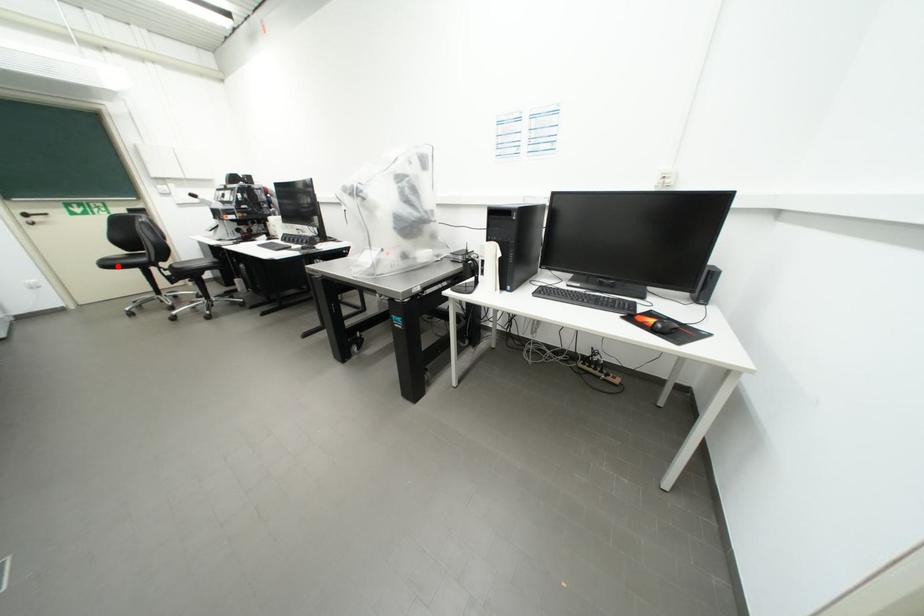
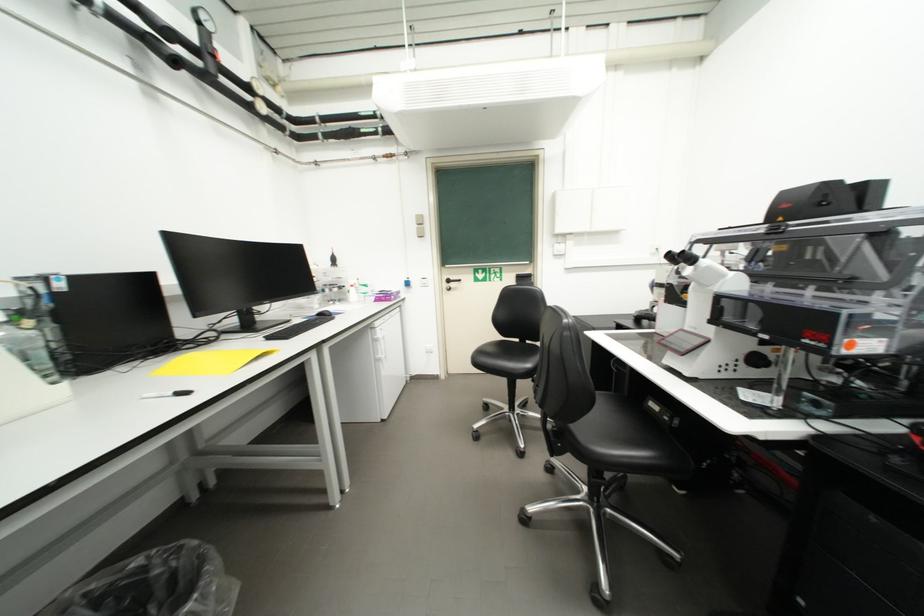
Locate, in the second image, the point that corresponds to the highlighted location in the first image.

(490, 362)